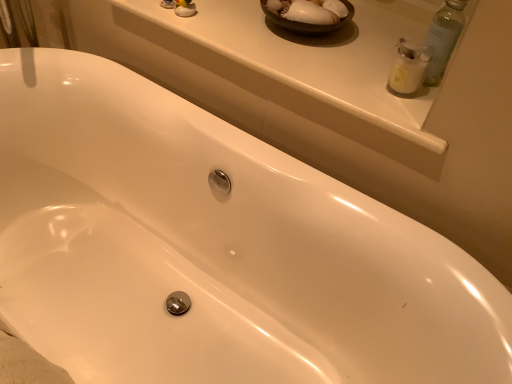
The height and width of the screenshot is (384, 512). What are the coordinates of `vacant area in front of white matte jar at upper right` in the screenshot? It's located at (401, 118).